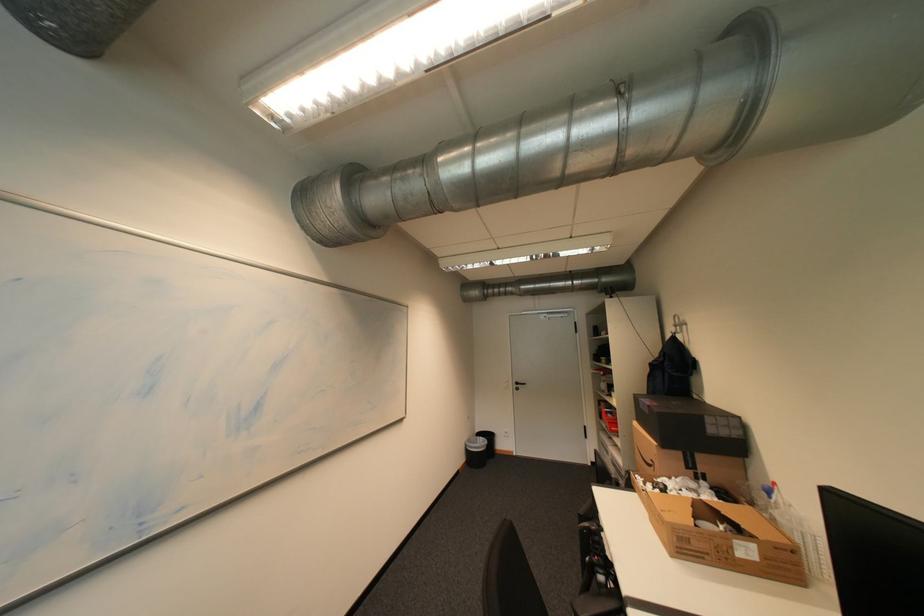
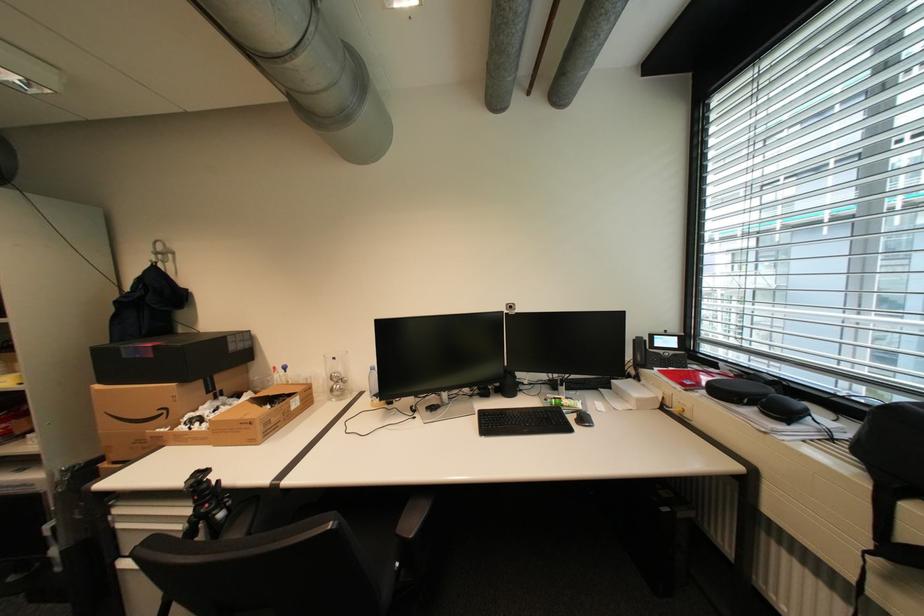
Question: Based on the continuous images, in which direction is the camera rotating? Reply with the corresponding letter.

Choices:
 (A) Left
 (B) Right
 (C) Up
 (D) Down

Answer: (B)